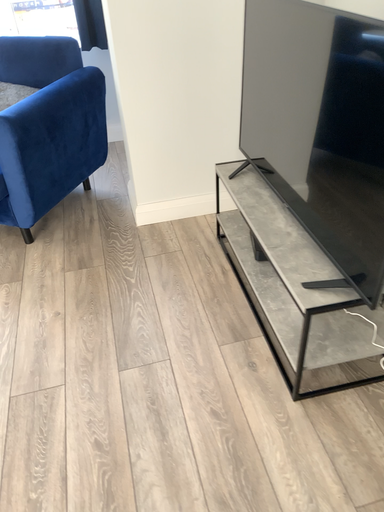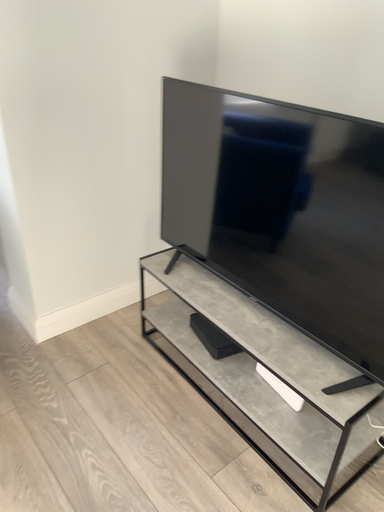
Question: Which way did the camera rotate in the video?

Choices:
 (A) rotated downward
 (B) rotated upward

Answer: (B)